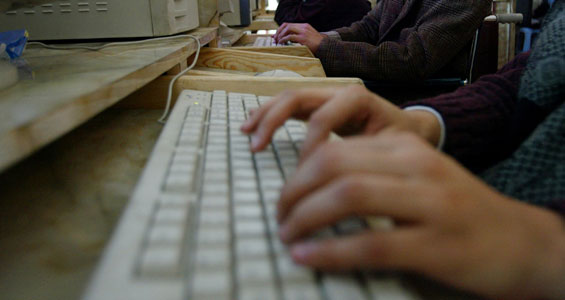
This screenshot has height=300, width=565. What are the coordinates of `cord` in the screenshot? It's located at (194, 56), (101, 43).